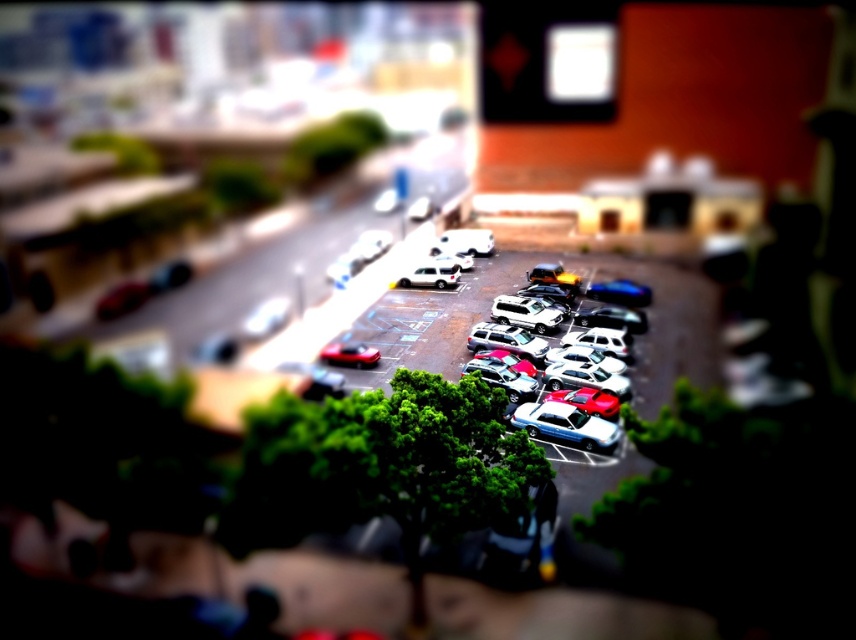
Question: Which object appears farthest from the camera in this image?

Choices:
 (A) satin silver suv at center
 (B) shiny silver sedan at center
 (C) shiny metallic cars at center

Answer: (A)

Question: Is shiny metallic cars at center behind satin silver suv at center?

Choices:
 (A) yes
 (B) no

Answer: (B)

Question: Which of the following is the farthest from the observer?

Choices:
 (A) (591, 346)
 (B) (428, 257)

Answer: (B)

Question: Is shiny silver sedan at center above satin silver suv at center?

Choices:
 (A) yes
 (B) no

Answer: (B)

Question: Does shiny silver sedan at center appear over satin silver suv at center?

Choices:
 (A) no
 (B) yes

Answer: (A)

Question: Based on their relative distances, which object is nearer to the satin silver suv at center?

Choices:
 (A) metallic blue sedan at center
 (B) shiny red car at center
 (C) shiny metallic cars at center

Answer: (C)